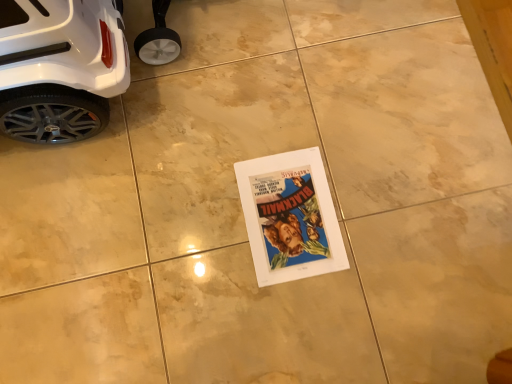
What do you see at coordinates (290, 217) in the screenshot?
I see `vibrant paper movie poster at center` at bounding box center [290, 217].

Measure the distance between point (281,221) and camera.

Point (281,221) is 38.35 inches away from camera.

Where is `vibrant paper movie poster at center`? vibrant paper movie poster at center is located at coordinates (290, 217).

At what (x,y) coordinates should I click in order to perform the action: click on vibrant paper movie poster at center. Please return your answer as a coordinate pair (x, y). The width and height of the screenshot is (512, 384). Looking at the image, I should click on (290, 217).